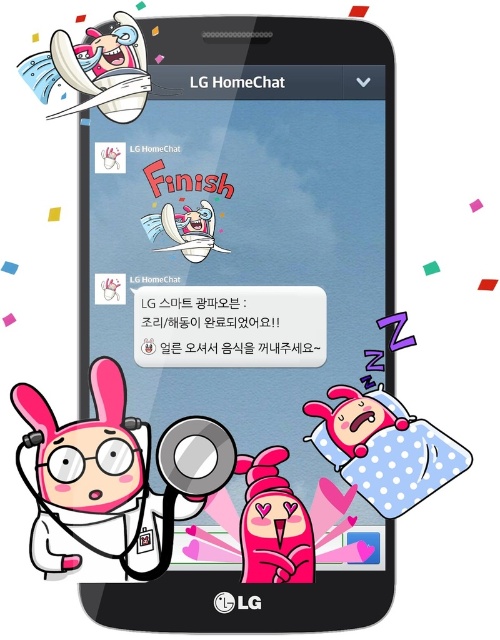
Question: Which point appears farthest from the camera in this image?

Choices:
 (A) (234, 365)
 (B) (104, 410)
 (C) (204, 220)

Answer: (A)

Question: Considering the relative positions of polka dot fabric pillow at lower right and matte white surfboard at upper left in the image provided, where is polka dot fabric pillow at lower right located with respect to matte white surfboard at upper left?

Choices:
 (A) right
 (B) left

Answer: (A)

Question: Is matte white surfboard at upper left above black plastic text at upper center?

Choices:
 (A) no
 (B) yes

Answer: (B)

Question: Can you confirm if white matte text message at center is positioned above pink matte heart at center?

Choices:
 (A) no
 (B) yes

Answer: (B)

Question: Considering the real-world distances, which object is closest to the polka dot fabric pillow at lower right?

Choices:
 (A) matte white surfboard at upper left
 (B) black plastic text at upper center
 (C) white glossy rabbit at center

Answer: (C)

Question: Which point appears closest to the camera in this image?

Choices:
 (A) (268, 460)
 (B) (281, 81)
 (C) (105, 416)
 (D) (187, 205)

Answer: (B)